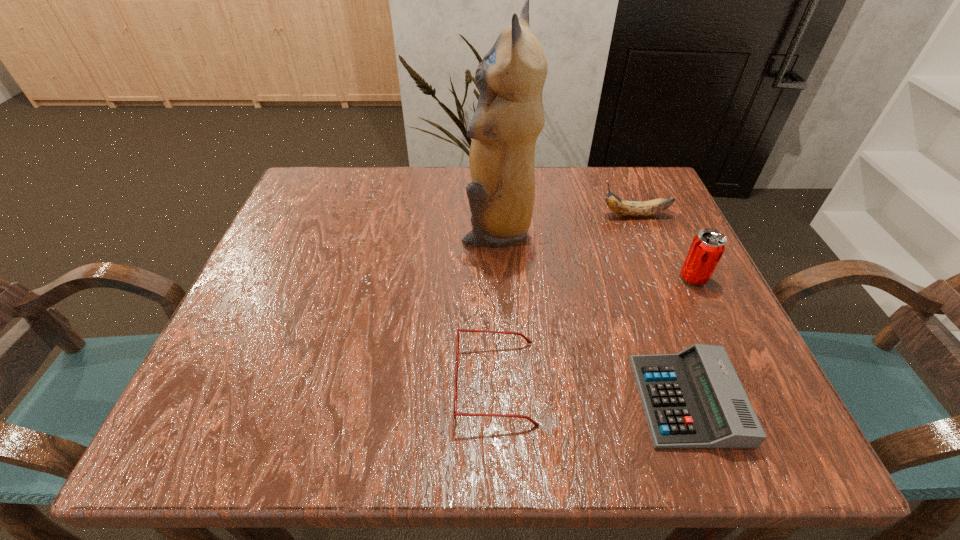
Locate an element on the screen. free space between the third nearest object and the tallest object is located at coordinates (595, 253).

Choose which object is the nearest neighbor to the second tallest object. Please provide its 2D coordinates. Your answer should be formatted as a tuple, i.e. [(x, y)], where the tuple contains the x and y coordinates of a point satisfying the conditions above.

[(627, 208)]

I want to click on object that is the second nearest to the spectacles, so click(509, 116).

Identify the location of free space that satisfies the following two spatial constraints: 1. on the face of the shortest object; 2. on the right side of the cat. The height and width of the screenshot is (540, 960). (505, 400).

Locate an element on the screen. The image size is (960, 540). free space in the image that satisfies the following two spatial constraints: 1. at the stem of the second tallest object; 2. on the left side of the third shortest object is located at coordinates (660, 278).

Where is `free spot that satisfies the following two spatial constraints: 1. on the face of the tallest object; 2. on the left side of the soda can`? free spot that satisfies the following two spatial constraints: 1. on the face of the tallest object; 2. on the left side of the soda can is located at coordinates (499, 278).

Where is `vacant area that satisfies the following two spatial constraints: 1. on the face of the calculator; 2. on the right side of the fourth tallest object`? The height and width of the screenshot is (540, 960). vacant area that satisfies the following two spatial constraints: 1. on the face of the calculator; 2. on the right side of the fourth tallest object is located at coordinates point(496,400).

You are a GUI agent. You are given a task and a screenshot of the screen. Output one action in this format:
    pyautogui.click(x=<x>, y=<y>)
    Task: Click on the free space that satisfies the following two spatial constraints: 1. at the stem of the third tallest object; 2. on the front side of the calculator
    This screenshot has height=540, width=960.
    Given the screenshot: What is the action you would take?
    pyautogui.click(x=710, y=400)

Where is `free spot that satisfies the following two spatial constraints: 1. on the face of the cat; 2. on the back side of the second tallest object`? Image resolution: width=960 pixels, height=540 pixels. free spot that satisfies the following two spatial constraints: 1. on the face of the cat; 2. on the back side of the second tallest object is located at coordinates (499, 278).

Locate an element on the screen. Image resolution: width=960 pixels, height=540 pixels. vacant space that satisfies the following two spatial constraints: 1. on the face of the spectacles; 2. on the left side of the calculator is located at coordinates (496, 400).